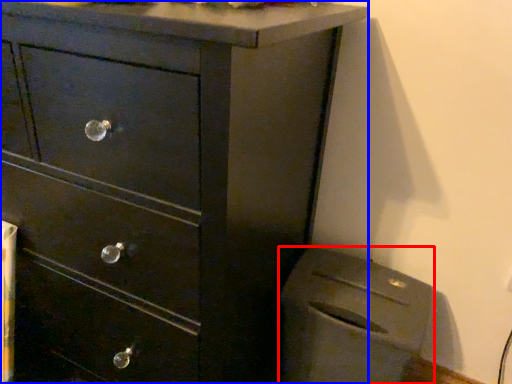
Question: Which object is further to the camera taking this photo, appliance (highlighted by a red box) or chest of drawers (highlighted by a blue box)?

Choices:
 (A) appliance
 (B) chest of drawers

Answer: (A)